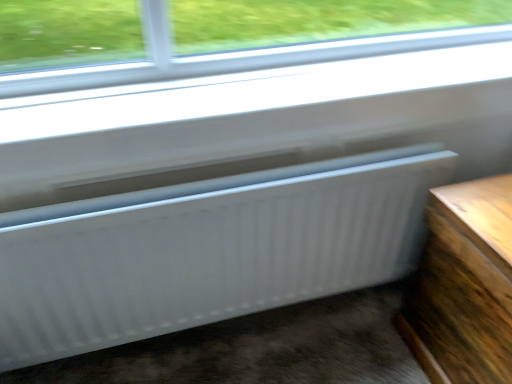
At what (x,y) coordinates should I click in order to perform the action: click on blank space situated above white ribbed radiator at lower center (from a real-world perspective). Please return your answer as a coordinate pair (x, y). Looking at the image, I should click on (227, 188).